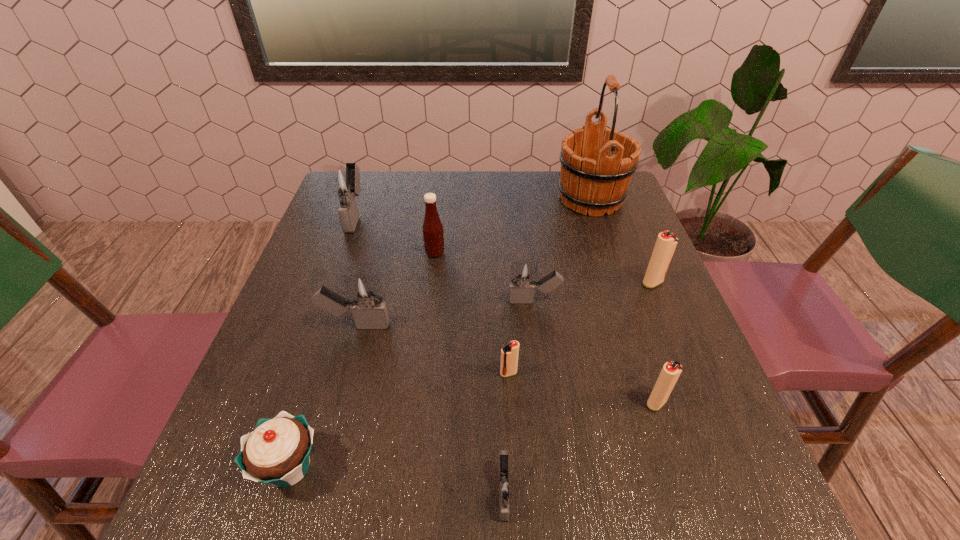
Identify the location of the fifth nearest igniter. (523, 275).

Where is `the fifth farthest object`? the fifth farthest object is located at coordinates (523, 275).

At what (x,y) coordinates should I click in order to perform the action: click on the nearest red igniter. Please return your answer as a coordinate pair (x, y). Looking at the image, I should click on (671, 371).

This screenshot has height=540, width=960. In order to click on the eighth farthest object in this screenshot , I will do `click(671, 371)`.

You are a GUI agent. You are given a task and a screenshot of the screen. Output one action in this format:
    pyautogui.click(x=<x>, y=<y>)
    Task: Click on the cupcake
    
    Given the screenshot: What is the action you would take?
    pyautogui.click(x=278, y=450)

The width and height of the screenshot is (960, 540). What are the coordinates of `the smallest red igniter` in the screenshot? It's located at (509, 354).

The width and height of the screenshot is (960, 540). What are the coordinates of `the leftmost red igniter` in the screenshot? It's located at (509, 354).

Identify the location of the nearest igniter. The image size is (960, 540). (503, 488).

This screenshot has width=960, height=540. What are the coordinates of `the smallest gray igniter` in the screenshot? It's located at (503, 488).

Identify the location of vacant space situated on the left of the tallest object. The image size is (960, 540). (432, 199).